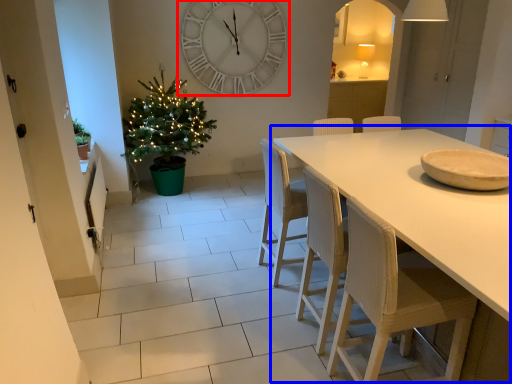
Question: Which point is closer to the camera, wall clock (highlighted by a red box) or table (highlighted by a blue box)?

Choices:
 (A) wall clock
 (B) table

Answer: (B)